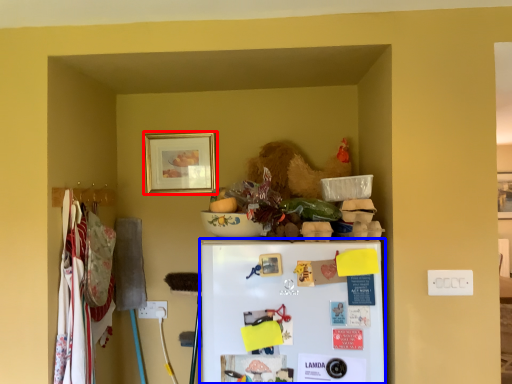
Question: Which object is further to the camera taking this photo, picture frame (highlighted by a red box) or refrigerator (highlighted by a blue box)?

Choices:
 (A) picture frame
 (B) refrigerator

Answer: (A)